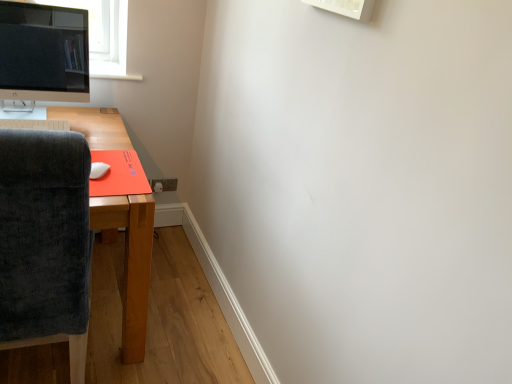
Question: Is dark gray fabric chair at left to the right of white matte mouse at lower left from the viewer's perspective?

Choices:
 (A) no
 (B) yes

Answer: (A)

Question: Does dark gray fabric chair at left lie behind white matte mouse at lower left?

Choices:
 (A) yes
 (B) no

Answer: (B)

Question: Considering the relative sizes of dark gray fabric chair at left and white matte mouse at lower left in the image provided, is dark gray fabric chair at left shorter than white matte mouse at lower left?

Choices:
 (A) yes
 (B) no

Answer: (B)

Question: From a real-world perspective, is dark gray fabric chair at left located beneath white matte mouse at lower left?

Choices:
 (A) no
 (B) yes

Answer: (B)

Question: Does dark gray fabric chair at left appear on the left side of white matte mouse at lower left?

Choices:
 (A) yes
 (B) no

Answer: (A)

Question: In terms of height, does white matte mouse at lower left look taller or shorter compared to white plastic keyboard at lower left?

Choices:
 (A) tall
 (B) short

Answer: (A)

Question: Is white matte mouse at lower left bigger or smaller than white plastic keyboard at lower left?

Choices:
 (A) small
 (B) big

Answer: (A)

Question: Does point pos(97,172) appear closer or farther from the camera than point pos(65,124)?

Choices:
 (A) farther
 (B) closer

Answer: (B)

Question: Do you think white matte mouse at lower left is within white plastic keyboard at lower left, or outside of it?

Choices:
 (A) inside
 (B) outside

Answer: (B)

Question: In the image, is white plastic keyboard at lower left positioned in front of or behind dark gray fabric chair at left?

Choices:
 (A) front
 (B) behind

Answer: (B)

Question: Looking at the image, does white plastic keyboard at lower left seem bigger or smaller compared to dark gray fabric chair at left?

Choices:
 (A) small
 (B) big

Answer: (A)

Question: Does point (18, 125) appear closer or farther from the camera than point (82, 365)?

Choices:
 (A) closer
 (B) farther

Answer: (A)

Question: From a real-world perspective, is white plastic keyboard at lower left positioned above or below dark gray fabric chair at left?

Choices:
 (A) below
 (B) above

Answer: (B)

Question: In the image, is brown plastic power outlet at lower center positioned in front of or behind white matte mouse at lower left?

Choices:
 (A) front
 (B) behind

Answer: (B)

Question: Looking at their shapes, would you say brown plastic power outlet at lower center is wider or thinner than white matte mouse at lower left?

Choices:
 (A) wide
 (B) thin

Answer: (B)